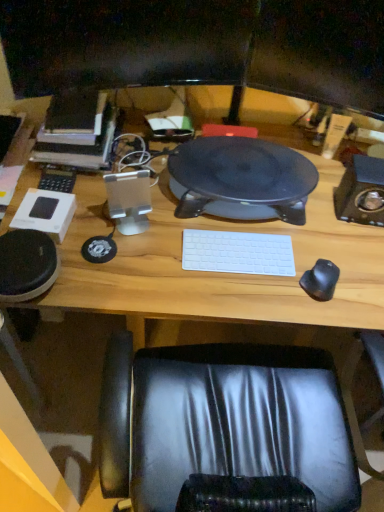
Identify the location of vacant space situated above black plastic speaker at center (from a real-world perspective). (243, 164).